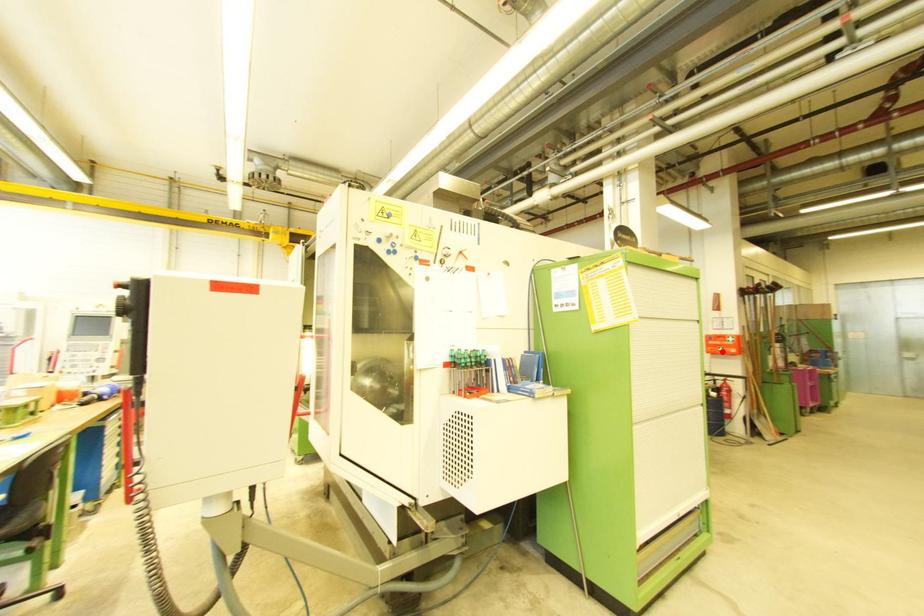
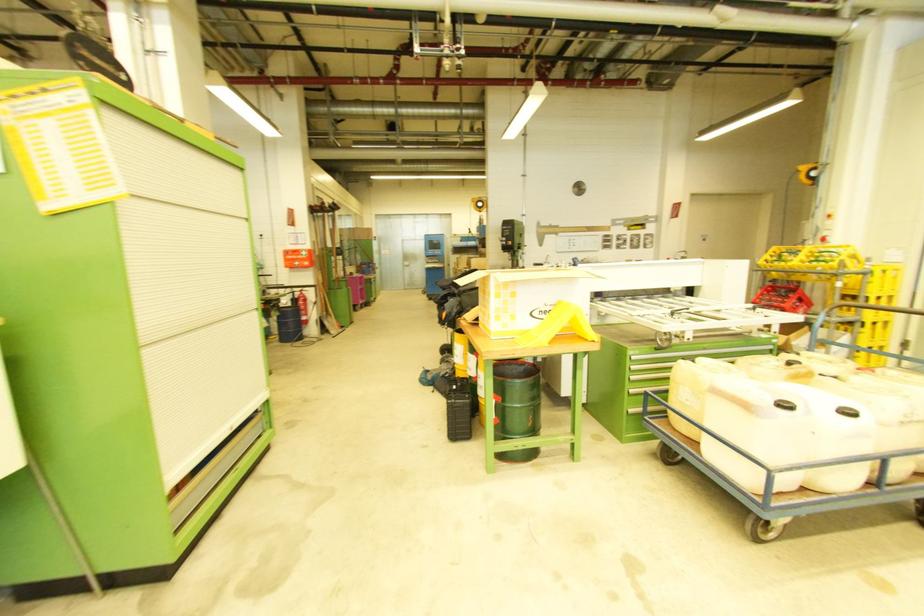
In the second image, find the point that corresponds to the highlighted location in the first image.

(299, 265)